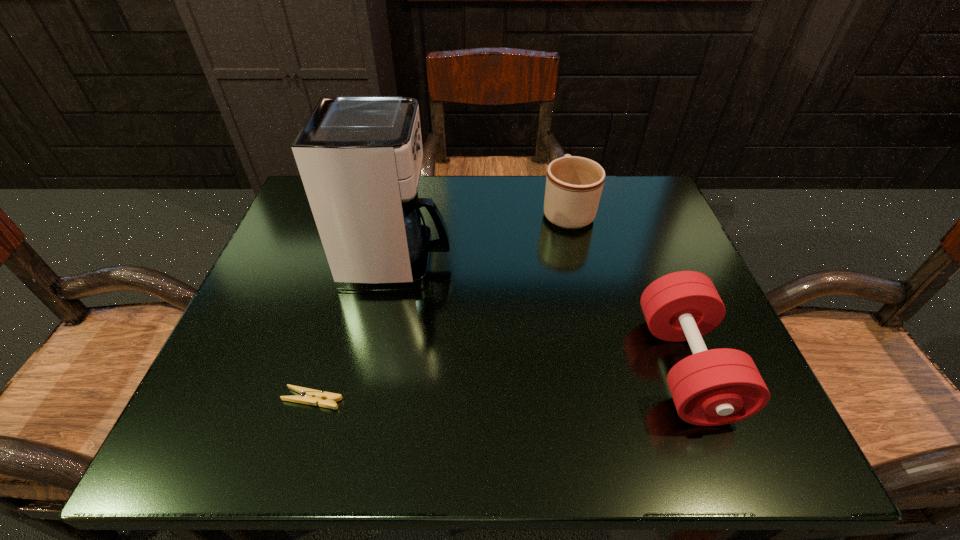
You are a GUI agent. You are given a task and a screenshot of the screen. Output one action in this format:
    pyautogui.click(x=<x>, y=<y>)
    Task: Click on the free space at the near edge of the desktop
    Image resolution: width=960 pixels, height=540 pixels.
    Given the screenshot: What is the action you would take?
    pyautogui.click(x=372, y=437)

Identify the location of vacant space at the left edge of the desktop. This screenshot has height=540, width=960. (278, 263).

In the image, there is a desktop. Where is `vacant region at the right edge`? vacant region at the right edge is located at coordinates (637, 325).

The height and width of the screenshot is (540, 960). In order to click on blank space at the near left corner in this screenshot , I will do `click(183, 444)`.

This screenshot has width=960, height=540. What are the coordinates of `free space between the shortest object and the coffee maker` in the screenshot? It's located at (356, 330).

You are a GUI agent. You are given a task and a screenshot of the screen. Output one action in this format:
    pyautogui.click(x=<x>, y=<y>)
    Task: Click on the unoccupied position between the clothespin and the farthest object
    This screenshot has width=960, height=540.
    Given the screenshot: What is the action you would take?
    pyautogui.click(x=440, y=305)

Locate an element on the screen. vacant area between the second farthest object and the shortest object is located at coordinates (356, 330).

Where is `blank region between the second object from right to left and the second farthest object`? blank region between the second object from right to left and the second farthest object is located at coordinates (483, 236).

Where is `free space between the farthest object and the rightmost object`? free space between the farthest object and the rightmost object is located at coordinates (626, 289).

At what (x,y) coordinates should I click in order to perform the action: click on vacant region between the rightmost object and the mug. Please return your answer as a coordinate pair (x, y). Looking at the image, I should click on (626, 289).